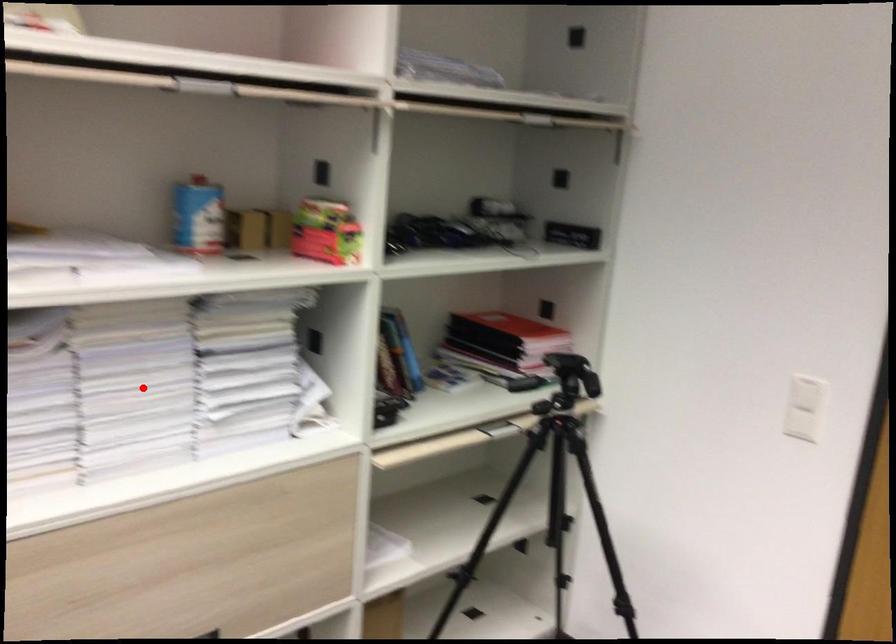
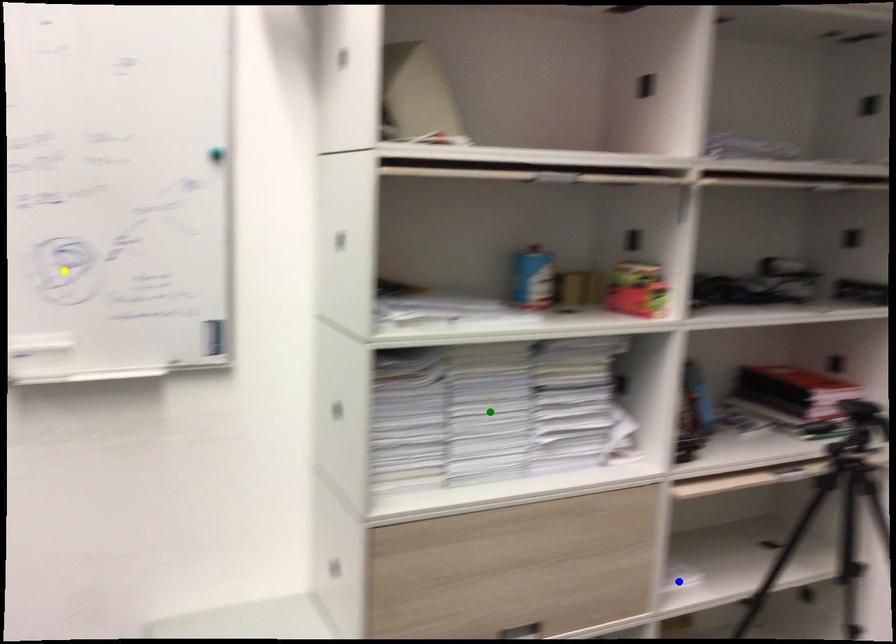
Question: I am providing you with two images of the same scene from different viewpoints. A red point is marked on the first image. You are given multiple points on the second image. Which spot in image 2 lines up with the point in image 1?

Choices:
 (A) yellow point
 (B) green point
 (C) blue point

Answer: (B)